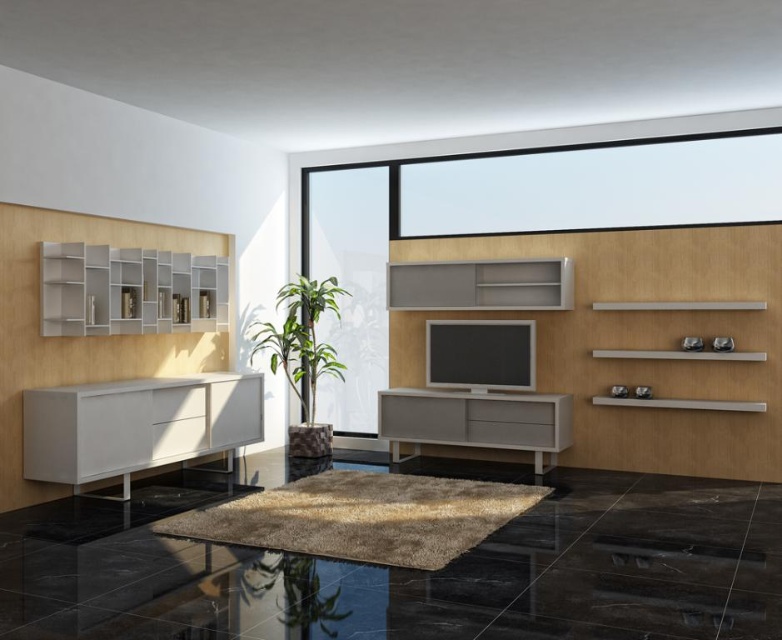
Question: Which of the following is the farthest from the observer?

Choices:
 (A) white matte shelves at left
 (B) transparent glass table at lower center
 (C) green leafy plant at center
 (D) matte gray shelf at upper center

Answer: (C)

Question: Based on their relative distances, which object is nearer to the matte gray shelf at upper center?

Choices:
 (A) white matte cabinet at left
 (B) transparent glass table at lower center

Answer: (A)

Question: Which object is farther from the camera taking this photo?

Choices:
 (A) transparent glass table at lower center
 (B) matte gray cabinet at center
 (C) white matte shelves at left

Answer: (B)

Question: Observing the image, what is the correct spatial positioning of white matte shelves at left in reference to matte gray shelf at upper center?

Choices:
 (A) left
 (B) right

Answer: (A)

Question: Does white matte cabinet at left appear over green leafy plant at center?

Choices:
 (A) yes
 (B) no

Answer: (B)

Question: Is transparent glass table at lower center above white matte cabinet at left?

Choices:
 (A) yes
 (B) no

Answer: (B)